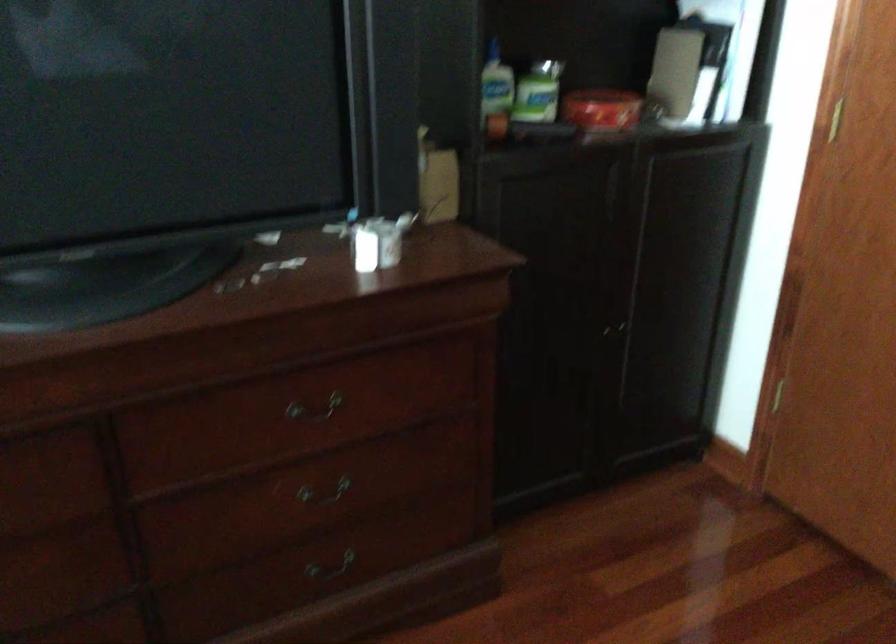
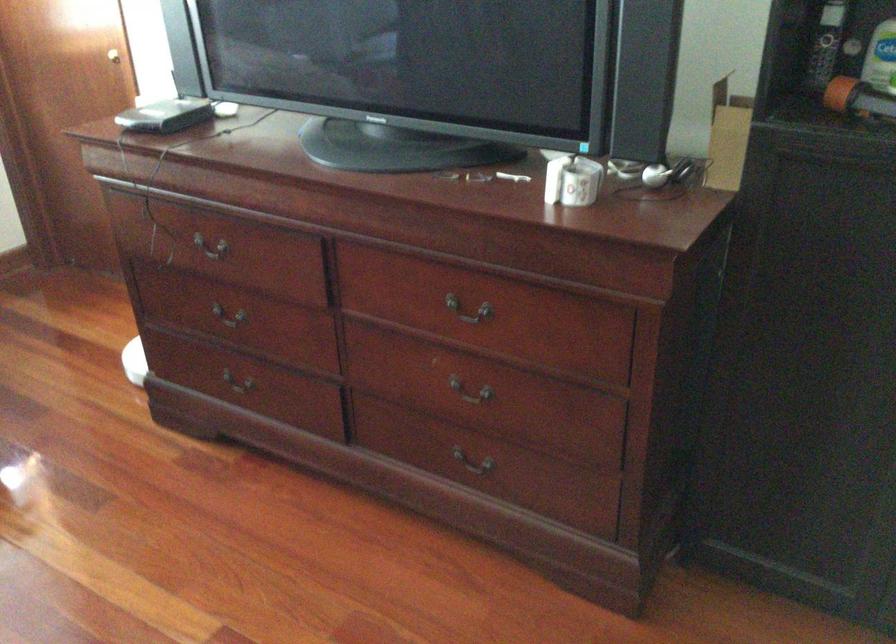
In the second image, find the point that corresponds to (x=303, y=494) in the first image.

(470, 392)